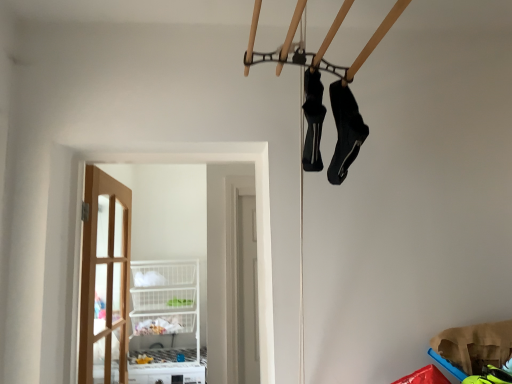
Question: In which direction should I rotate to look at black matte shoe at center, placed as the 2th footwear when sorted from right to left?

Choices:
 (A) left
 (B) right

Answer: (B)

Question: Is black matte shoe at center, acting as the 1th footwear starting from the left, shorter than black synthetic socks at upper right, which is the 1th footwear from right to left?

Choices:
 (A) yes
 (B) no

Answer: (A)

Question: Can you confirm if black matte shoe at center, acting as the 1th footwear starting from the left, is thinner than black synthetic socks at upper right, which is the 1th footwear from right to left?

Choices:
 (A) yes
 (B) no

Answer: (A)

Question: Can you confirm if black matte shoe at center, placed as the 2th footwear when sorted from right to left, is positioned to the left of black synthetic socks at upper right, arranged as the second footwear when viewed from the left?

Choices:
 (A) yes
 (B) no

Answer: (A)

Question: Can you confirm if black matte shoe at center, placed as the 2th footwear when sorted from right to left, is wider than black synthetic socks at upper right, arranged as the second footwear when viewed from the left?

Choices:
 (A) yes
 (B) no

Answer: (B)

Question: Is black matte shoe at center, acting as the 1th footwear starting from the left, facing towards black synthetic socks at upper right, arranged as the second footwear when viewed from the left?

Choices:
 (A) yes
 (B) no

Answer: (A)

Question: From a real-world perspective, is black matte shoe at center, placed as the 2th footwear when sorted from right to left, located higher than black synthetic socks at upper right, arranged as the second footwear when viewed from the left?

Choices:
 (A) no
 (B) yes

Answer: (B)

Question: Does black matte shoe at center, acting as the 1th footwear starting from the left, appear on the right side of wooden door at left?

Choices:
 (A) no
 (B) yes

Answer: (B)

Question: Is the depth of black matte shoe at center, placed as the 2th footwear when sorted from right to left, greater than that of wooden door at left?

Choices:
 (A) yes
 (B) no

Answer: (B)

Question: From the image's perspective, is black matte shoe at center, acting as the 1th footwear starting from the left, over wooden door at left?

Choices:
 (A) no
 (B) yes

Answer: (B)

Question: Can you confirm if black matte shoe at center, placed as the 2th footwear when sorted from right to left, is bigger than wooden door at left?

Choices:
 (A) yes
 (B) no

Answer: (B)

Question: Can you confirm if black matte shoe at center, placed as the 2th footwear when sorted from right to left, is smaller than wooden door at left?

Choices:
 (A) yes
 (B) no

Answer: (A)

Question: From a real-world perspective, is black matte shoe at center, placed as the 2th footwear when sorted from right to left, on top of wooden door at left?

Choices:
 (A) yes
 (B) no

Answer: (A)

Question: From a real-world perspective, does black synthetic socks at upper right, arranged as the second footwear when viewed from the left, sit lower than clear glass door at center?

Choices:
 (A) no
 (B) yes

Answer: (A)